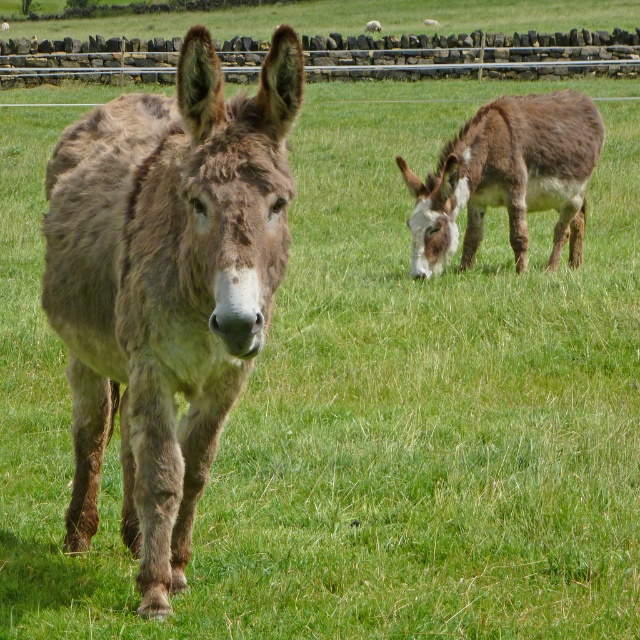
You are a farmer checking the pasture. You see the brown fuzzy donkey at center and the brushed metal fence at upper center. Which one is shorter in height?

The brown fuzzy donkey at center is shorter in height compared to the brushed metal fence at upper center.

You are a photographer trying to capture both the brown fuzzy mule at right and the brushed metal fence at upper center in your shot. Based on their positions, which one would appear closer to the camera in the photo?

The brown fuzzy mule at right would appear closer to the camera because it is positioned further to the viewer than the brushed metal fence at upper center, meaning it is nearer in the frame.

You are a farmer who needs to lead the brown fuzzy donkey at center and the brown fuzzy mule at right to their pens. Based on their positions in the field, which animal would you approach first to ensure you can reach them without walking around any obstacles?

The brown fuzzy donkey at center is in front of the brown fuzzy mule at right, so you should approach the brown fuzzy donkey at center first since it is closer and you can reach it without needing to go around the mule.